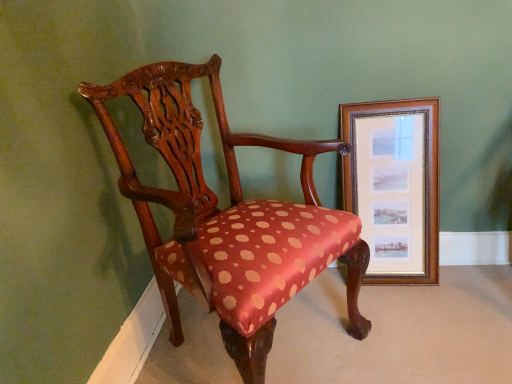
Question: Relative to wooden frame at right, is polished wood chair at center in front or behind?

Choices:
 (A) behind
 (B) front

Answer: (B)

Question: In terms of height, does polished wood chair at center look taller or shorter compared to wooden frame at right?

Choices:
 (A) tall
 (B) short

Answer: (A)

Question: In terms of width, does polished wood chair at center look wider or thinner when compared to wooden frame at right?

Choices:
 (A) thin
 (B) wide

Answer: (B)

Question: Relative to polished wood chair at center, is wooden frame at right in front or behind?

Choices:
 (A) front
 (B) behind

Answer: (B)

Question: Visually, is wooden frame at right positioned to the left or to the right of polished wood chair at center?

Choices:
 (A) right
 (B) left

Answer: (A)

Question: From a real-world perspective, relative to polished wood chair at center, is wooden frame at right vertically above or below?

Choices:
 (A) below
 (B) above

Answer: (A)

Question: From their relative heights in the image, would you say wooden frame at right is taller or shorter than polished wood chair at center?

Choices:
 (A) tall
 (B) short

Answer: (B)